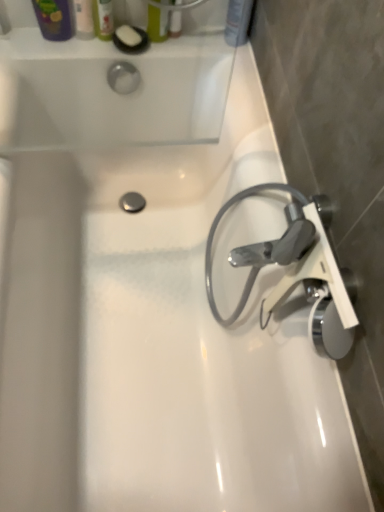
Question: Looking at their shapes, would you say satin chrome faucet at right is wider or thinner than translucent plastic soap at upper left, acting as the 3th toiletry starting from the right?

Choices:
 (A) wide
 (B) thin

Answer: (A)

Question: Is point (271, 254) closer or farther from the camera than point (105, 23)?

Choices:
 (A) closer
 (B) farther

Answer: (A)

Question: Which object is the farthest from the satin chrome faucet at right?

Choices:
 (A) matte plastic shampoo bottle at upper right, which ranks as the 4th toiletry in left-to-right order
 (B) translucent plastic mouthwash at upper center
 (C) matte green bottle at upper center, the second toiletry in the right-to-left sequence
 (D) translucent plastic soap at upper left, acting as the 3th toiletry starting from the right
 (E) matte plastic soap at upper left, which is the 1th toiletry from left to right

Answer: (E)

Question: Based on their relative distances, which object is nearer to the matte green bottle at upper center, the second toiletry in the right-to-left sequence?

Choices:
 (A) satin chrome faucet at right
 (B) translucent plastic mouthwash at upper center
 (C) translucent plastic soap at upper left, positioned as the 2th toiletry in left-to-right order
 (D) matte plastic shampoo bottle at upper right, which ranks as the 4th toiletry in left-to-right order
 (E) matte plastic soap at upper left, which is the 1th toiletry from left to right

Answer: (B)